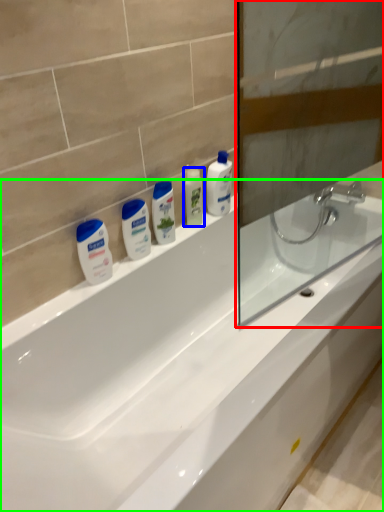
Question: Which object is the closest to the screen door (highlighted by a red box)? Choose among these: mouthwash (highlighted by a blue box) or bathtub (highlighted by a green box).

Choices:
 (A) mouthwash
 (B) bathtub

Answer: (B)